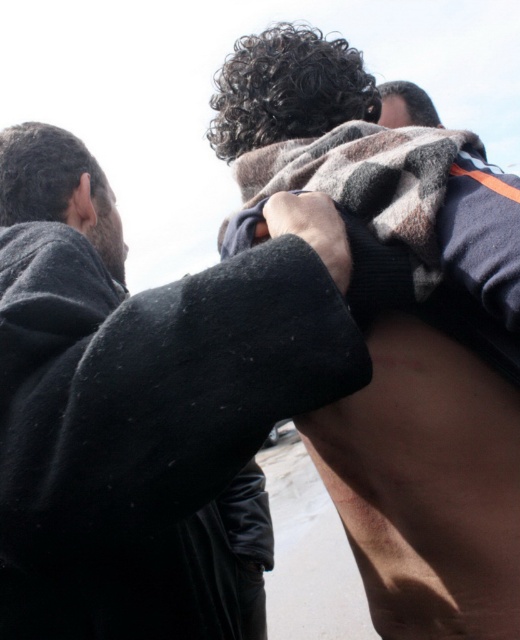
Question: Among these objects, which one is farthest from the camera?

Choices:
 (A) fuzzy wool blanket at upper center
 (B) dark gray wool sweater at upper center

Answer: (A)

Question: Which of the following is the closest to the observer?

Choices:
 (A) (495, 422)
 (B) (54, 547)

Answer: (B)

Question: Does dark gray wool sweater at upper center have a larger size compared to fuzzy wool blanket at upper center?

Choices:
 (A) yes
 (B) no

Answer: (A)

Question: Which of the following is the closest to the observer?

Choices:
 (A) fuzzy wool blanket at upper center
 (B) dark gray wool sweater at upper center

Answer: (B)

Question: Does dark gray wool sweater at upper center have a greater width compared to fuzzy wool blanket at upper center?

Choices:
 (A) yes
 (B) no

Answer: (A)

Question: Is dark gray wool sweater at upper center wider than fuzzy wool blanket at upper center?

Choices:
 (A) no
 (B) yes

Answer: (B)